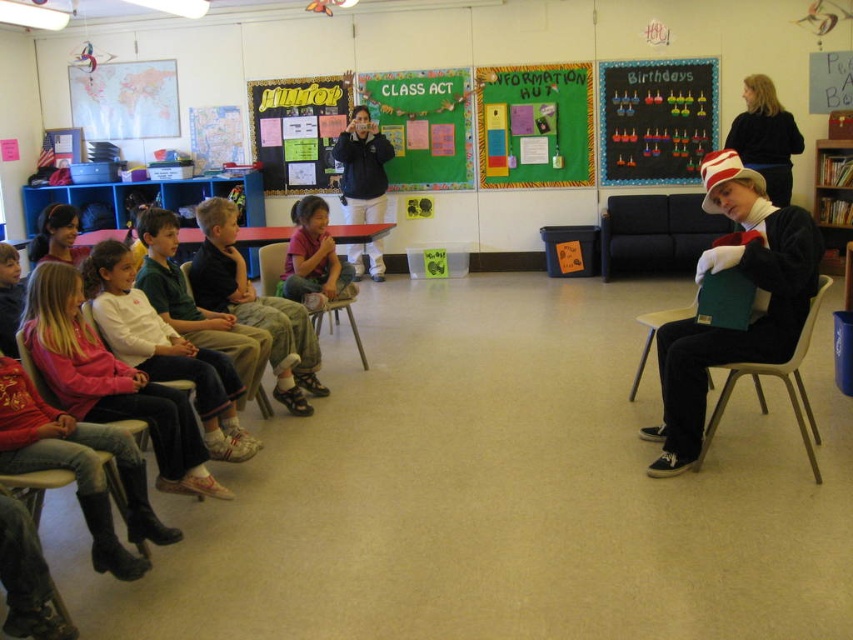
You are a student in the classroom and need to reach both the matte black book at right and the white plush hat at right for a class activity. If you can only carry one item at a time, which item should you pick up first to minimize the total distance you walk?

You should pick up the matte black book at right first because it is farther away from you than the white plush hat at right, so picking it up first reduces the need to walk back towards it later.

You are a student in the classroom and want to place your backpack between the matte black book at right and the wooden chair at lower left. Can you do this?

The matte black book at right is to the right of the wooden chair at lower left, so there is space between them to place your backpack.